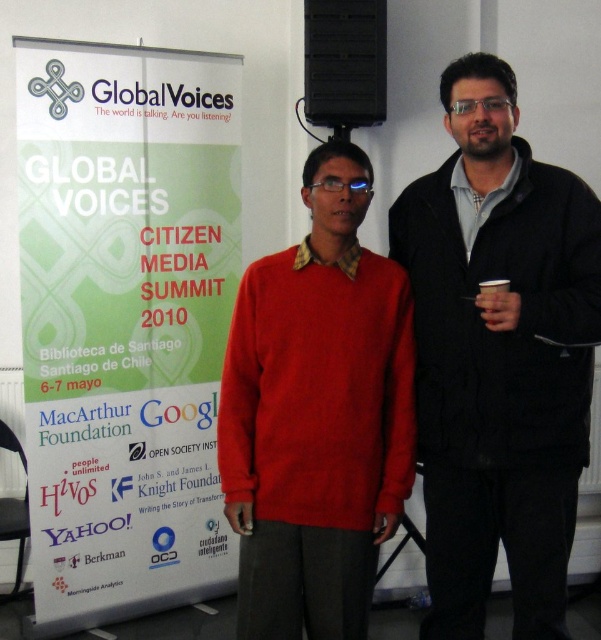
Question: Is black matte jacket at right below black paper cup at right?

Choices:
 (A) yes
 (B) no

Answer: (A)

Question: Is the position of black matte jacket at right less distant than that of matte red sweater at center?

Choices:
 (A) no
 (B) yes

Answer: (B)

Question: Which point is farther to the camera?

Choices:
 (A) (266, 456)
 (B) (554, 180)

Answer: (A)

Question: Which of the following is the farthest from the observer?

Choices:
 (A) (227, 346)
 (B) (545, 166)
 (C) (504, 289)
 (D) (183, 282)

Answer: (D)

Question: Can you confirm if white paper poster at left is positioned to the left of black matte jacket at right?

Choices:
 (A) yes
 (B) no

Answer: (A)

Question: Among these points, which one is farthest from the camera?

Choices:
 (A) (230, 186)
 (B) (380, 328)
 (C) (486, 282)

Answer: (A)